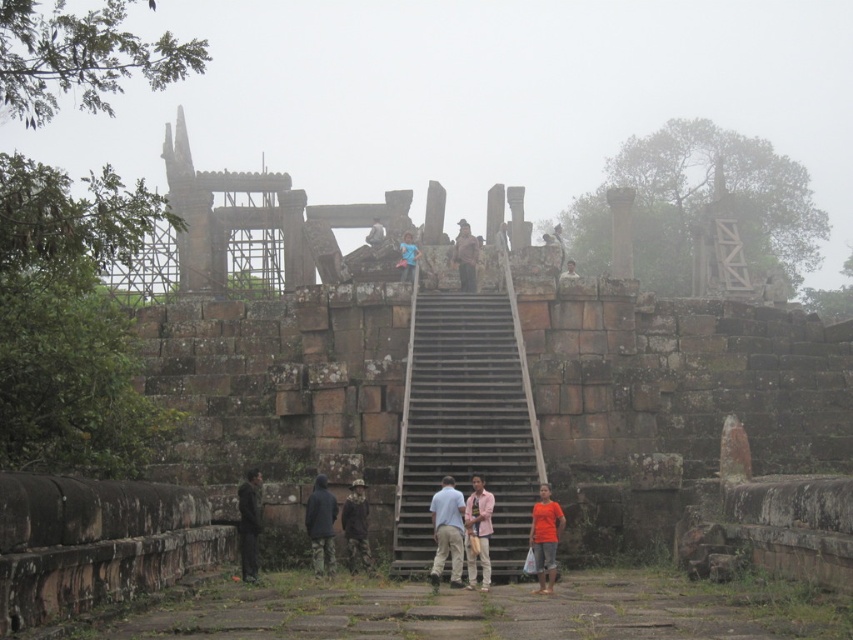
Question: Does brown stone stairs at center appear over brown leather jacket at upper center?

Choices:
 (A) yes
 (B) no

Answer: (B)

Question: Which of the following is the farthest from the observer?

Choices:
 (A) (564, 273)
 (B) (352, 506)
 (C) (260, 512)

Answer: (A)

Question: Which point is farther to the camera?

Choices:
 (A) dark gray fabric jacket at lower left
 (B) brown leather jacket at upper center
 (C) camouflage jacket at center
 (D) dark brown leather jacket at lower left

Answer: (B)

Question: Does brown stone stairs at center have a lesser width compared to light pink shirt at center?

Choices:
 (A) no
 (B) yes

Answer: (A)

Question: Is brown leather jacket at upper center thinner than light blue fabric shirt at upper center?

Choices:
 (A) no
 (B) yes

Answer: (B)

Question: Which point is closer to the camera?

Choices:
 (A) (378, 241)
 (B) (405, 273)
 (C) (311, 541)
 (D) (518, 545)

Answer: (D)